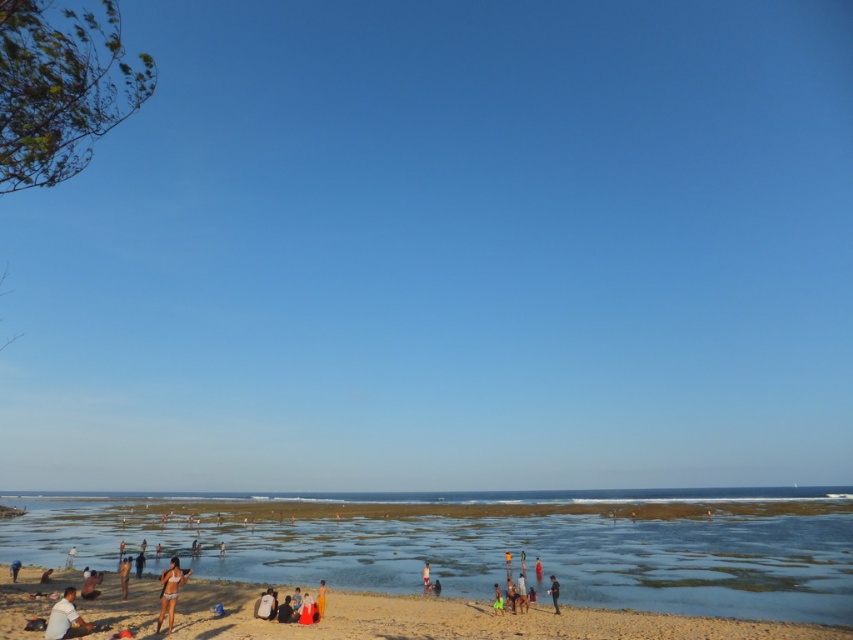
Is white matte bikini at lower center bigger than matte black person at lower left?

Yes, white matte bikini at lower center is bigger than matte black person at lower left.

Consider the image. Can you confirm if white matte bikini at lower center is positioned to the right of matte black person at lower left?

Yes, white matte bikini at lower center is to the right of matte black person at lower left.

Who is more forward, (173, 596) or (94, 579)?

Point (173, 596) is in front.

The height and width of the screenshot is (640, 853). What are the coordinates of `white matte bikini at lower center` in the screenshot? It's located at (170, 592).

Looking at this image, who is shorter, dark blue fabric at lower center or beige sand at lower center?

Standing shorter between the two is beige sand at lower center.

Who is more distant from viewer, (556, 584) or (425, 586)?

The point (425, 586) is behind.

The height and width of the screenshot is (640, 853). What are the coordinates of `dark blue fabric at lower center` in the screenshot? It's located at click(554, 593).

Who is positioned more to the left, light brown sand at lower center or matte black person at lower left?

matte black person at lower left

Is light brown sand at lower center above matte black person at lower left?

Indeed, light brown sand at lower center is positioned over matte black person at lower left.

Image resolution: width=853 pixels, height=640 pixels. What do you see at coordinates (456, 620) in the screenshot? I see `light brown sand at lower center` at bounding box center [456, 620].

In order to click on light brown sand at lower center in this screenshot , I will do `click(456, 620)`.